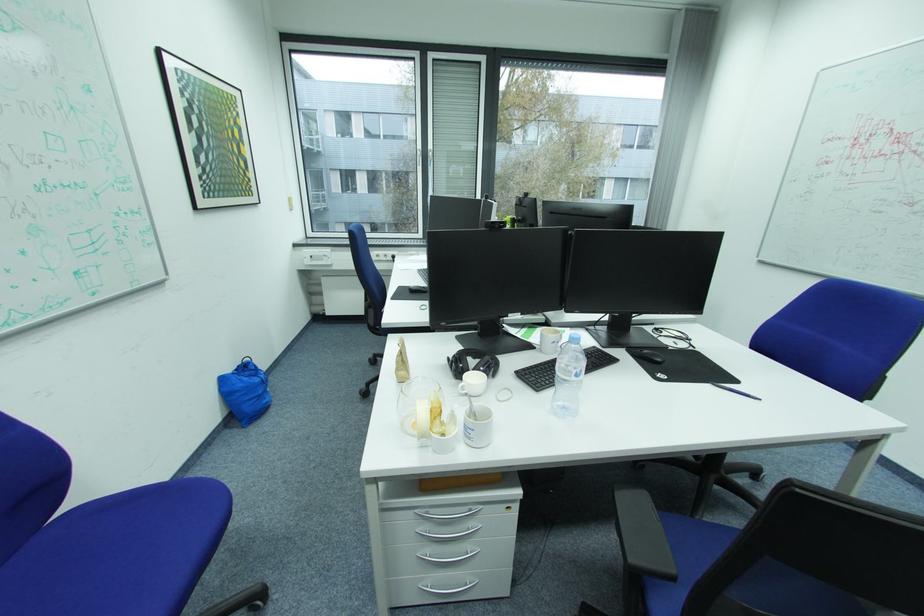
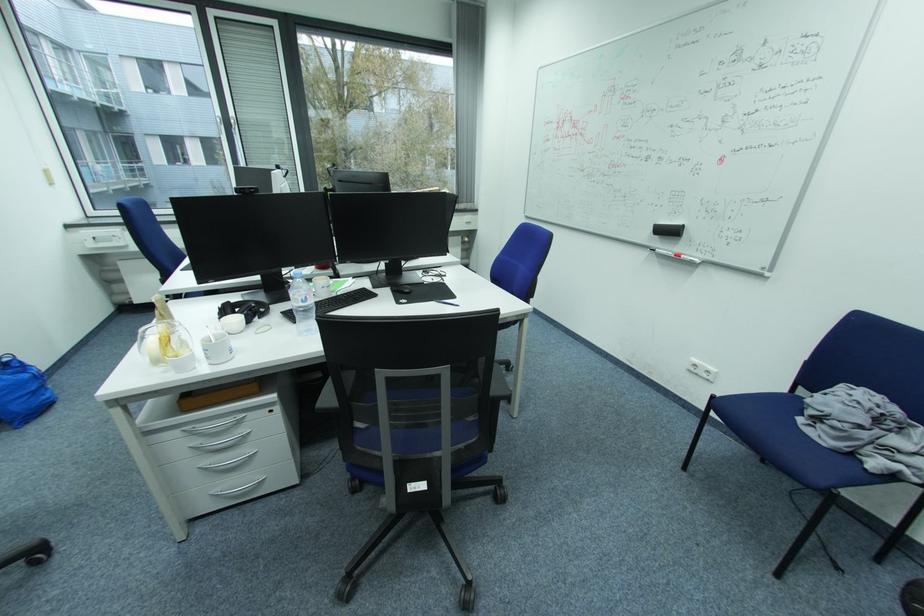
Find the pixel in the second image that matches (x=582, y=375) in the first image.

(310, 301)